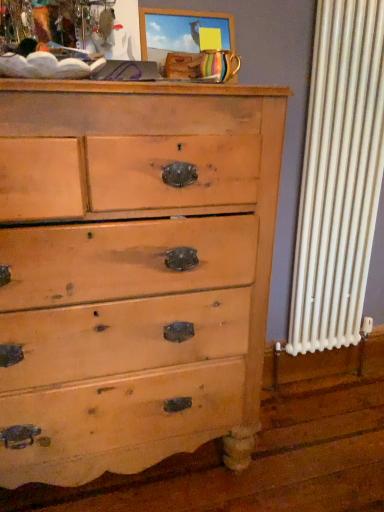
The image size is (384, 512). Describe the element at coordinates (179, 32) in the screenshot. I see `wooden picture frame at upper center` at that location.

Find the location of a particular element. wooden picture frame at upper center is located at coordinates (179, 32).

The width and height of the screenshot is (384, 512). What do you see at coordinates (132, 273) in the screenshot? I see `light brown wood chest of drawers at center` at bounding box center [132, 273].

I want to click on light brown wood chest of drawers at center, so click(132, 273).

At what (x,y) coordinates should I click in order to perform the action: click on wooden picture frame at upper center. Please return your answer as a coordinate pair (x, y). The width and height of the screenshot is (384, 512). Looking at the image, I should click on (179, 32).

Is wooden picture frame at upper center at the right side of light brown wood chest of drawers at center?

Yes.

Between wooden picture frame at upper center and light brown wood chest of drawers at center, which one is positioned behind?

wooden picture frame at upper center is further away from the camera.

Which is behind, point (200, 26) or point (275, 130)?

The point (200, 26) is more distant.

From the image's perspective, is wooden picture frame at upper center on light brown wood chest of drawers at center?

Correct, wooden picture frame at upper center appears higher than light brown wood chest of drawers at center in the image.

From a real-world perspective, which object stands above the other?

wooden picture frame at upper center.

Does wooden picture frame at upper center have a lesser width compared to light brown wood chest of drawers at center?

Yes.

Is wooden picture frame at upper center shorter than light brown wood chest of drawers at center?

Yes.

Looking at this image, which of these two, wooden picture frame at upper center or light brown wood chest of drawers at center, is bigger?

light brown wood chest of drawers at center.

Is wooden picture frame at upper center spatially inside light brown wood chest of drawers at center, or outside of it?

wooden picture frame at upper center exists outside the volume of light brown wood chest of drawers at center.

Is wooden picture frame at upper center positioned far away from light brown wood chest of drawers at center?

No, wooden picture frame at upper center is in close proximity to light brown wood chest of drawers at center.

Is light brown wood chest of drawers at center at the back of wooden picture frame at upper center?

No.

How many degrees apart are the facing directions of wooden picture frame at upper center and light brown wood chest of drawers at center?

There is a 1.62-degree angle between the facing directions of wooden picture frame at upper center and light brown wood chest of drawers at center.

In order to click on picture frame on the right side of light brown wood chest of drawers at center in this screenshot , I will do `click(179, 32)`.

Is light brown wood chest of drawers at center to the left of wooden picture frame at upper center from the viewer's perspective?

Yes.

In the scene shown: Which object is further away from the camera, light brown wood chest of drawers at center or wooden picture frame at upper center?

wooden picture frame at upper center is further from the camera.

Considering the positions of point (262, 365) and point (165, 53), is point (262, 365) closer or farther from the camera than point (165, 53)?

Point (262, 365) is farther from the camera than point (165, 53).

From the image's perspective, is light brown wood chest of drawers at center located above wooden picture frame at upper center?

Incorrect, from the image's perspective, light brown wood chest of drawers at center is lower than wooden picture frame at upper center.

From a real-world perspective, is light brown wood chest of drawers at center below wooden picture frame at upper center?

Correct, in the physical world, light brown wood chest of drawers at center is lower than wooden picture frame at upper center.

In terms of width, does light brown wood chest of drawers at center look wider or thinner when compared to wooden picture frame at upper center?

Clearly, light brown wood chest of drawers at center has more width compared to wooden picture frame at upper center.

Can you confirm if light brown wood chest of drawers at center is taller than wooden picture frame at upper center?

Indeed, light brown wood chest of drawers at center has a greater height compared to wooden picture frame at upper center.

Considering the sizes of light brown wood chest of drawers at center and wooden picture frame at upper center in the image, is light brown wood chest of drawers at center bigger or smaller than wooden picture frame at upper center?

Clearly, light brown wood chest of drawers at center is larger in size than wooden picture frame at upper center.

Is light brown wood chest of drawers at center completely or partially outside of wooden picture frame at upper center?

light brown wood chest of drawers at center lies outside wooden picture frame at upper center's area.

Is light brown wood chest of drawers at center far from wooden picture frame at upper center?

No, light brown wood chest of drawers at center is not far away from wooden picture frame at upper center.

Is light brown wood chest of drawers at center positioned with its back to wooden picture frame at upper center?

No, light brown wood chest of drawers at center is not facing away from wooden picture frame at upper center.

How different are the orientations of light brown wood chest of drawers at center and wooden picture frame at upper center in degrees?

1.62 degrees separate the facing orientations of light brown wood chest of drawers at center and wooden picture frame at upper center.

Identify the location of chest of drawers below the wooden picture frame at upper center (from a real-world perspective). The height and width of the screenshot is (512, 384). (132, 273).

Locate an element on the screen. The height and width of the screenshot is (512, 384). picture frame above the light brown wood chest of drawers at center (from the image's perspective) is located at coordinates (179, 32).

You are a GUI agent. You are given a task and a screenshot of the screen. Output one action in this format:
    pyautogui.click(x=<x>, y=<y>)
    Task: Click on the chest of drawers lying below the wooden picture frame at upper center (from the image's perspective)
    Image resolution: width=384 pixels, height=512 pixels.
    Given the screenshot: What is the action you would take?
    pyautogui.click(x=132, y=273)